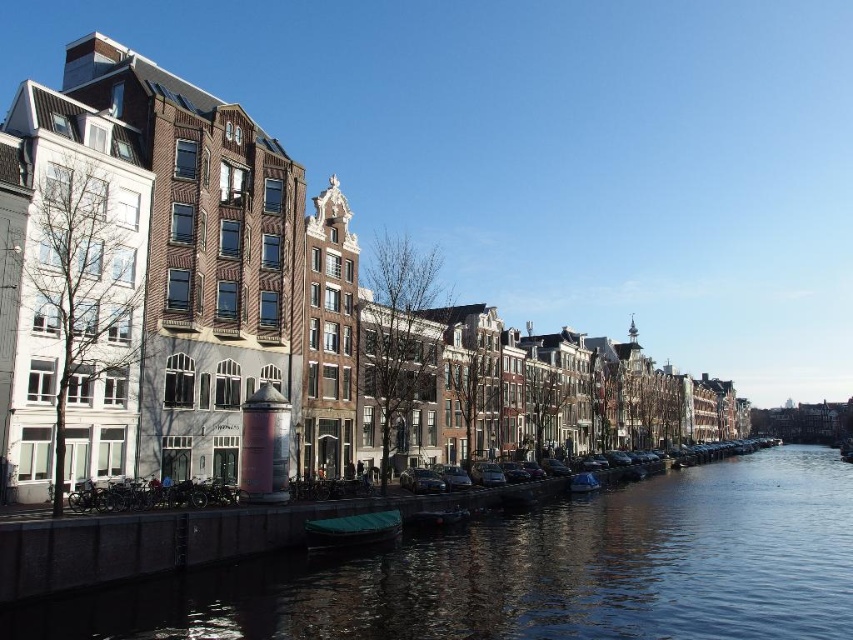
You are planning to take a photo of the canal scene. You want to ensure that both the smooth concrete water at center and the green matte boat at lower center are clearly visible. Based on their sizes in the image, which object should you focus on to capture both effectively?

The smooth concrete water at center is larger in size than the green matte boat at lower center. To capture both effectively, focus on the larger object, the smooth concrete water at center, as it will provide a better frame of reference for including the smaller boat in the shot.

You are a tourist standing on the dock and want to take a photo of both the green matte boat at lower center and the blue plastic boat at lower center. Which boat should you position yourself closer to in order to include both in the frame?

You should position yourself closer to the green matte boat at lower center because it is in front of the blue plastic boat at lower center, so moving closer to the front boat will help capture both in the frame.